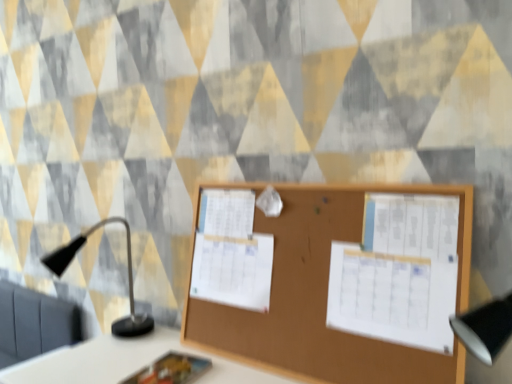
Question: Considering the positions of point (58, 259) and point (257, 297), is point (58, 259) closer or farther from the camera than point (257, 297)?

Choices:
 (A) farther
 (B) closer

Answer: (A)

Question: Do you think black matte table lamp at left is within white paper at center, the second poster viewed from the right, or outside of it?

Choices:
 (A) inside
 (B) outside

Answer: (B)

Question: Which of these objects is positioned closest to the brown wood bulletin board at center?

Choices:
 (A) matte plastic notebook at lower center
 (B) white paper at center, which is the 2th poster in front-to-back order
 (C) black matte table lamp at left
 (D) white paper at center, the first poster from the front

Answer: (D)

Question: Which object is positioned closest to the brown wood bulletin board at center?

Choices:
 (A) black matte table lamp at left
 (B) matte plastic notebook at lower center
 (C) white paper at center, which is the first poster from right to left
 (D) white paper at center, which is the 2th poster in front-to-back order

Answer: (C)